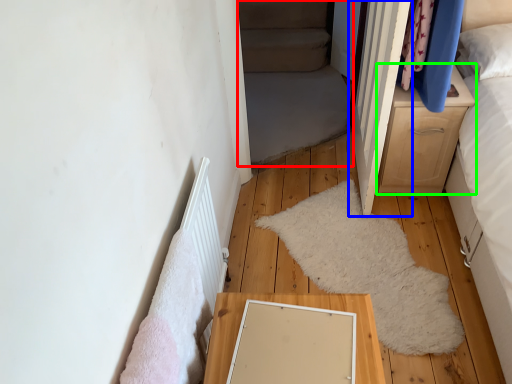
Question: Which object is the farthest from bed frame (highlighted by a red box)? Choose among these: door (highlighted by a blue box) or chest of drawers (highlighted by a green box).

Choices:
 (A) door
 (B) chest of drawers

Answer: (B)